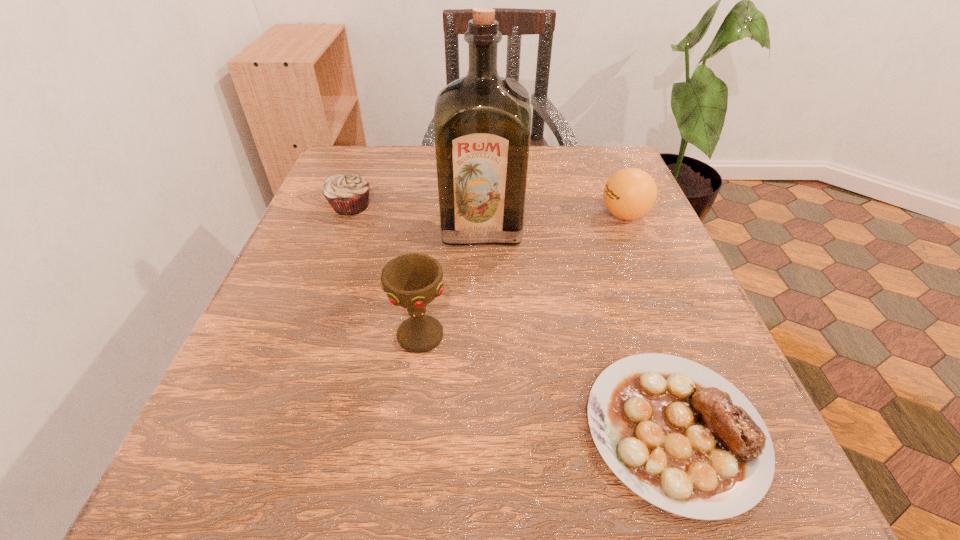
You are a GUI agent. You are given a task and a screenshot of the screen. Output one action in this format:
    pyautogui.click(x=<x>, y=<y>)
    Task: Click on the free spot located 0.360m on the side with brand of the third tallest object
    Image resolution: width=960 pixels, height=540 pixels.
    Given the screenshot: What is the action you would take?
    pyautogui.click(x=426, y=215)

Locate an element on the screen. free space located 0.130m on the back of the second shortest object is located at coordinates (366, 165).

Where is `vacant space situated 0.360m on the back of the shortest object`? The image size is (960, 540). vacant space situated 0.360m on the back of the shortest object is located at coordinates (601, 217).

Find the location of `object that is at the far edge`. object that is at the far edge is located at coordinates (347, 194).

Identify the location of object at the near edge. This screenshot has width=960, height=540. (679, 435).

The image size is (960, 540). Find the location of `object present at the left edge`. object present at the left edge is located at coordinates (347, 194).

You are a GUI agent. You are given a task and a screenshot of the screen. Output one action in this format:
    pyautogui.click(x=<x>, y=<y>)
    Task: Click on the ping-pong ball that is positioned at the right edge
    
    Given the screenshot: What is the action you would take?
    pyautogui.click(x=630, y=193)

Identify the location of steak that is at the right edge. (679, 435).

The width and height of the screenshot is (960, 540). What are the coordinates of `object present at the far left corner` in the screenshot? It's located at (347, 194).

Locate an element on the screen. object that is at the near right corner is located at coordinates point(679,435).